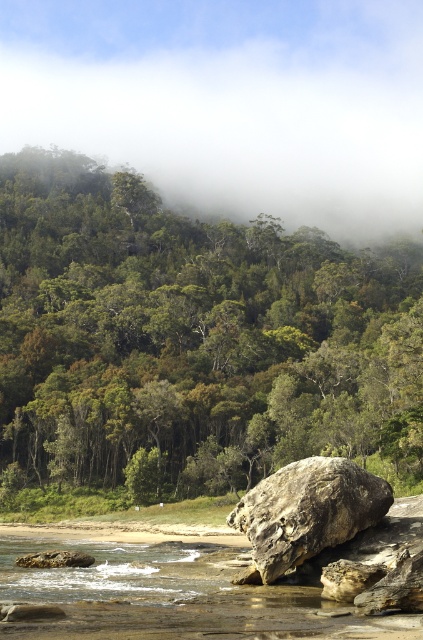
Question: Which of the following is the farthest from the observer?

Choices:
 (A) (307, 490)
 (B) (3, 76)
 (C) (386, 452)

Answer: (B)

Question: Is green leafy tree at center positioned at the back of rusty stone boulder at center?

Choices:
 (A) yes
 (B) no

Answer: (A)

Question: Among these points, which one is nearest to the camera?

Choices:
 (A) (400, 118)
 (B) (140, 260)
 (C) (332, 524)

Answer: (C)

Question: Observing the image, what is the correct spatial positioning of green leafy tree at center in reference to foggy misty forest at upper center?

Choices:
 (A) left
 (B) right

Answer: (B)

Question: Which is farther from the green leafy tree at center?

Choices:
 (A) foggy misty forest at upper center
 (B) rusty stone boulder at center

Answer: (A)

Question: Considering the relative positions of green leafy tree at center and rusty stone boulder at center in the image provided, where is green leafy tree at center located with respect to rusty stone boulder at center?

Choices:
 (A) left
 (B) right

Answer: (A)